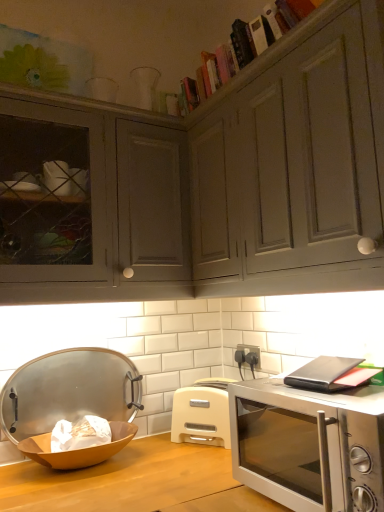
Identify the location of matte gray cabinet at upper left. (94, 203).

The image size is (384, 512). Describe the element at coordinates (69, 391) in the screenshot. I see `metallic silver tray at left` at that location.

The width and height of the screenshot is (384, 512). Describe the element at coordinates (294, 163) in the screenshot. I see `matte gray cabinet at upper center` at that location.

The width and height of the screenshot is (384, 512). What are the coordinates of `silver metallic microwave oven at lower right` in the screenshot? It's located at [309, 445].

From the image's perspective, is matte gray cabinet at upper left below beige plastic toaster at center?

Actually, matte gray cabinet at upper left appears above beige plastic toaster at center in the image.

Which of these two, matte gray cabinet at upper left or beige plastic toaster at center, is thinner?

With smaller width is beige plastic toaster at center.

From a real-world perspective, is matte gray cabinet at upper left beneath beige plastic toaster at center?

No.

Based on the photo, is matte gray cabinet at upper left inside or outside of beige plastic toaster at center?

matte gray cabinet at upper left is not inside beige plastic toaster at center, it's outside.

Is hardcover books at upper center far away from matte gray cabinet at upper left?

Result: They are positioned close to each other.

Does point (264, 58) come closer to viewer compared to point (50, 98)?

Yes.

Can you confirm if hardcover books at upper center is positioned to the left of matte gray cabinet at upper left?

In fact, hardcover books at upper center is to the right of matte gray cabinet at upper left.

Which is more to the left, silver metallic microwave oven at lower right or hardcover books at upper center?

Positioned to the left is hardcover books at upper center.

Considering the sizes of silver metallic microwave oven at lower right and hardcover books at upper center in the image, is silver metallic microwave oven at lower right wider or thinner than hardcover books at upper center?

silver metallic microwave oven at lower right is wider than hardcover books at upper center.

Is the depth of silver metallic microwave oven at lower right less than that of hardcover books at upper center?

Yes, silver metallic microwave oven at lower right is closer to the camera.

Is matte gray cabinet at upper center far away from metallic silver tray at left?

Actually, matte gray cabinet at upper center and metallic silver tray at left are a little close together.

Which object is further away from the camera taking this photo, matte gray cabinet at upper center or metallic silver tray at left?

metallic silver tray at left is more distant.

Is matte gray cabinet at upper center taller than metallic silver tray at left?

Yes.

Measure the distance from matte gray cabinet at upper center to metallic silver tray at left.

The distance of matte gray cabinet at upper center from metallic silver tray at left is 32.87 inches.

Can you confirm if matte gray cabinet at upper left is smaller than silver metallic microwave oven at lower right?

No, matte gray cabinet at upper left is not smaller than silver metallic microwave oven at lower right.

Between matte gray cabinet at upper left and silver metallic microwave oven at lower right, which one has smaller width?

With smaller width is matte gray cabinet at upper left.

Image resolution: width=384 pixels, height=512 pixels. What are the coordinates of `microwave oven below the matte gray cabinet at upper left (from a real-world perspective)` in the screenshot? It's located at (309, 445).

From a real-world perspective, between matte gray cabinet at upper left and silver metallic microwave oven at lower right, who is vertically lower?

silver metallic microwave oven at lower right.

Is hardcover books at upper center far from wooden bowl at lower left?

Yes.

Locate an element on the screen. This screenshot has width=384, height=512. book above the wooden bowl at lower left (from the image's perspective) is located at coordinates (262, 59).

How different are the orientations of hardcover books at upper center and wooden bowl at lower left in degrees?

The angular difference between hardcover books at upper center and wooden bowl at lower left is 89.4 degrees.

Can you tell me how much beige plastic toaster at center and matte gray cabinet at upper center differ in facing direction?

34.6 degrees.

Based on the photo, between beige plastic toaster at center and matte gray cabinet at upper center, which one is positioned behind?

beige plastic toaster at center is further from the camera.

The image size is (384, 512). What are the coordinates of `drawer in front of the beige plastic toaster at center` in the screenshot? It's located at (294, 163).

Locate an element on the screen. This screenshot has width=384, height=512. toaster that appears below the matte gray cabinet at upper left (from the image's perspective) is located at coordinates (202, 413).

You are a GUI agent. You are given a task and a screenshot of the screen. Output one action in this format:
    pyautogui.click(x=<x>, y=<y>)
    Task: Click on the cabinetry directly beneath the hardcover books at upper center (from a real-world perspective)
    
    Given the screenshot: What is the action you would take?
    pyautogui.click(x=94, y=203)

Looking at the image, which one is located further to matte gray cabinet at upper left, beige plastic toaster at center or wooden bowl at lower left?

wooden bowl at lower left is positioned further to the anchor matte gray cabinet at upper left.

Estimate the real-world distances between objects in this image. Which object is further from wooden bowl at lower left, metallic silver tray at left or silver metallic microwave oven at lower right?

Among the two, silver metallic microwave oven at lower right is located further to wooden bowl at lower left.

Which object lies nearer to the anchor point beige plastic toaster at center, silver metallic microwave oven at lower right or metallic silver tray at left?

Among the two, metallic silver tray at left is located nearer to beige plastic toaster at center.

Estimate the real-world distances between objects in this image. Which object is closer to matte gray cabinet at upper left, wooden bowl at lower left or hardcover books at upper center?

hardcover books at upper center lies closer to matte gray cabinet at upper left than the other object.

Considering their positions, is matte gray cabinet at upper left positioned closer to metallic silver tray at left than silver metallic microwave oven at lower right?

Among the two, matte gray cabinet at upper left is located nearer to metallic silver tray at left.

Which object lies nearer to the anchor point silver metallic microwave oven at lower right, beige plastic toaster at center or wooden bowl at lower left?

The object closer to silver metallic microwave oven at lower right is beige plastic toaster at center.

From the image, which object appears to be farther from matte gray cabinet at upper left, silver metallic microwave oven at lower right or metallic silver tray at left?

Among the two, silver metallic microwave oven at lower right is located further to matte gray cabinet at upper left.

Considering their positions, is matte gray cabinet at upper left positioned further to matte gray cabinet at upper center than hardcover books at upper center?

The object further to matte gray cabinet at upper center is matte gray cabinet at upper left.

Find the location of a particular element. book between matte gray cabinet at upper left and matte gray cabinet at upper center in the horizontal direction is located at coordinates (262, 59).

Find the location of a particular element. The width and height of the screenshot is (384, 512). bowl positioned between silver metallic microwave oven at lower right and beige plastic toaster at center from near to far is located at coordinates (78, 449).

At what (x,y) coordinates should I click in order to perform the action: click on cabinetry between matte gray cabinet at upper center and beige plastic toaster at center from top to bottom. Please return your answer as a coordinate pair (x, y). This screenshot has height=512, width=384. Looking at the image, I should click on (94, 203).

You are a GUI agent. You are given a task and a screenshot of the screen. Output one action in this format:
    pyautogui.click(x=<x>, y=<y>)
    Task: Click on the microwave oven between matte gray cabinet at upper center and wooden bowl at lower left in the vertical direction
    This screenshot has width=384, height=512.
    Given the screenshot: What is the action you would take?
    pyautogui.click(x=309, y=445)